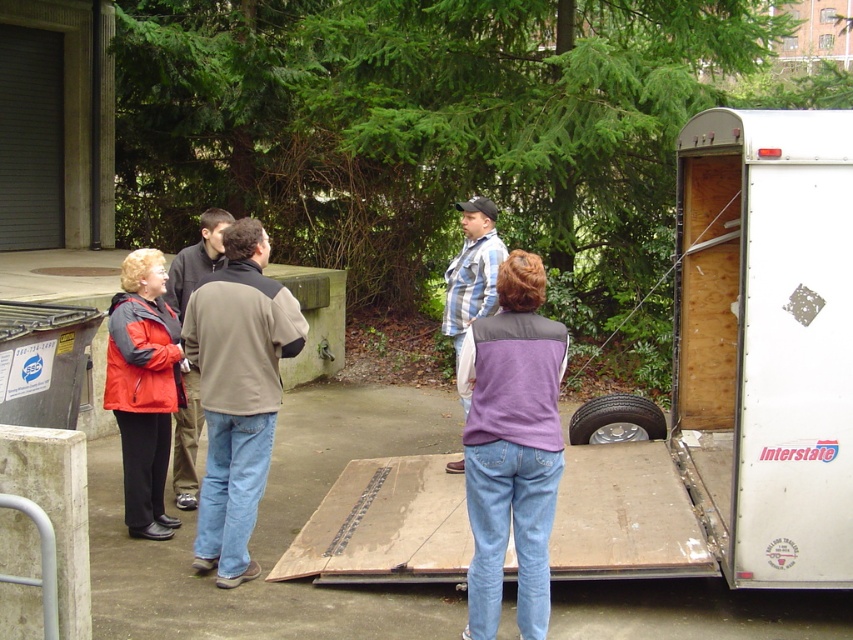
You are a delivery person who needs to place a package between the brown leather jacket at center and the black rubber tire at lower right. The package requires a space of 10 feet. Is there enough space?

The distance between the brown leather jacket at center and the black rubber tire at lower right is 9.69 feet, which is slightly less than the required 10 feet. Therefore, there is not enough space to place the package between them.

Where is the brown fleece jacket at center located in the image?

The brown fleece jacket at center is located at point (236, 392) in the image.

You are a delivery person who needs to locate the blue striped shirt at center and the black rubber tire at lower right in the scene. According to the spatial arrangement, which object is positioned closer to the left side of the image?

The blue striped shirt at center is to the left of the black rubber tire at lower right, so the blue striped shirt at center is closer to the left side of the image.